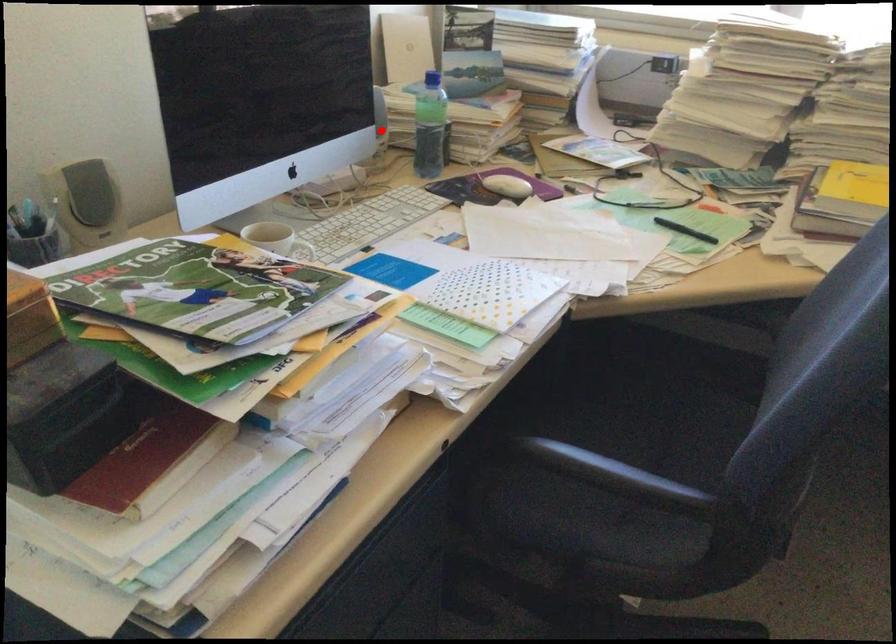
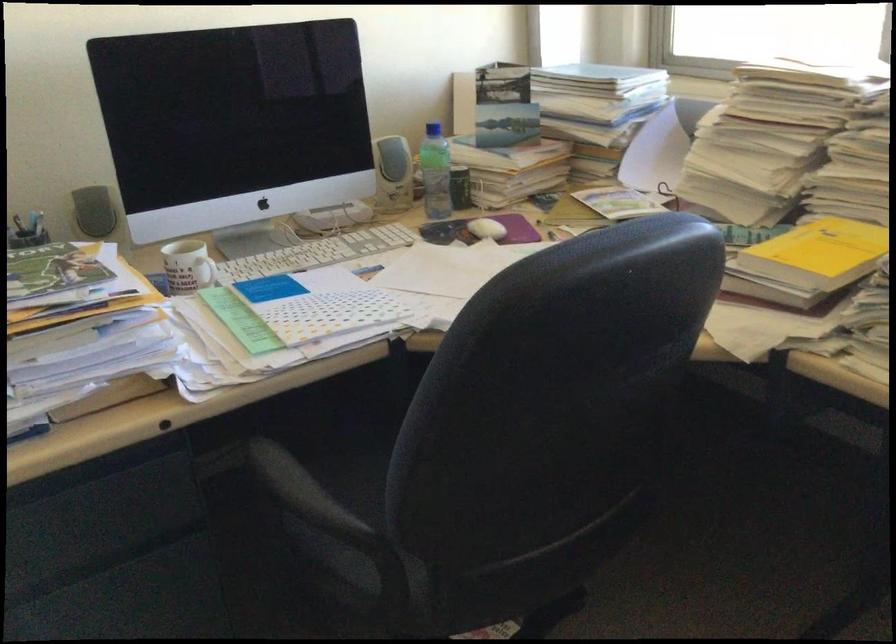
In the second image, find the point that corresponds to the highlighted location in the first image.

(392, 174)